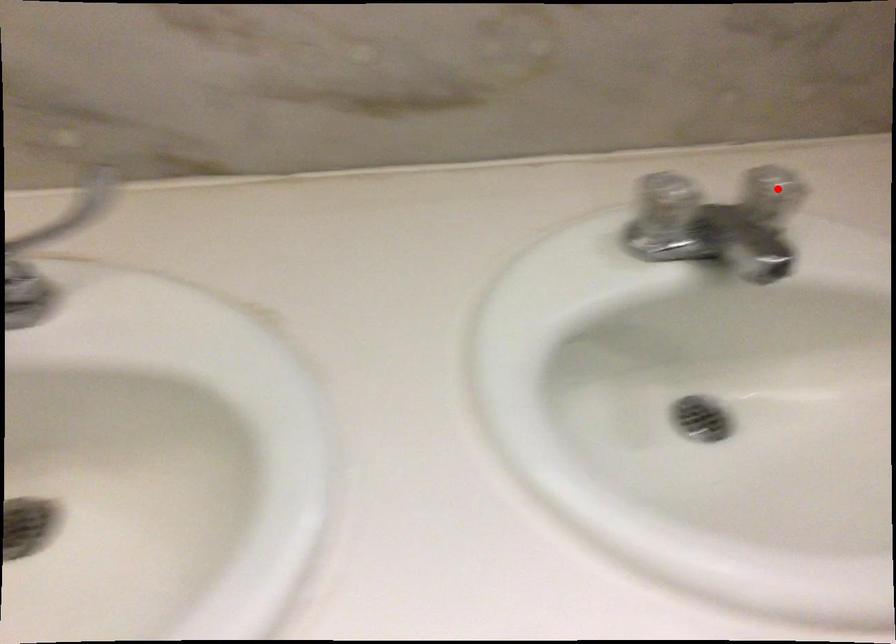
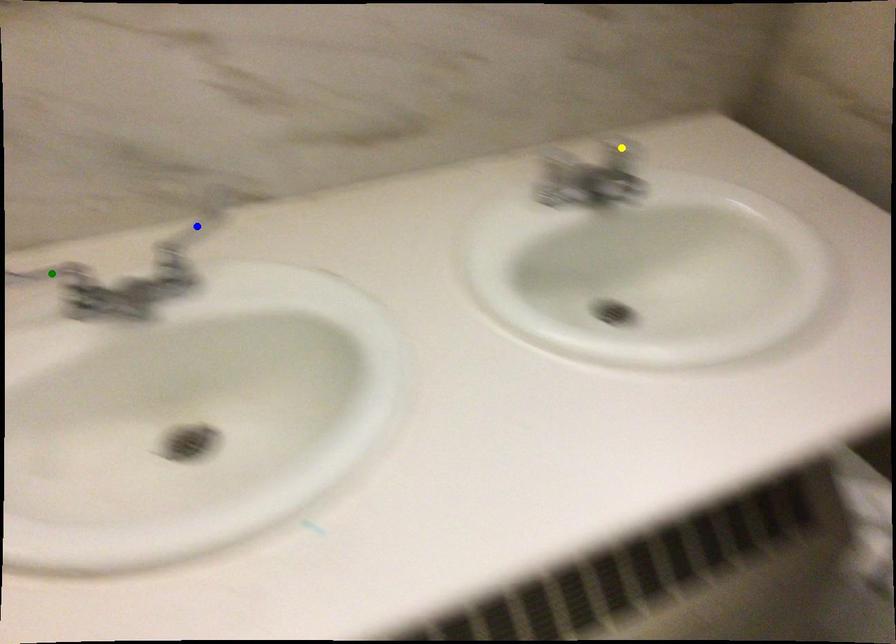
Question: I am providing you with two images of the same scene from different viewpoints. A red point is marked on the first image. You are given multiple points on the second image. In image 2, which mark is for the same physical point as the one in image 1?

Choices:
 (A) green point
 (B) blue point
 (C) yellow point

Answer: (C)